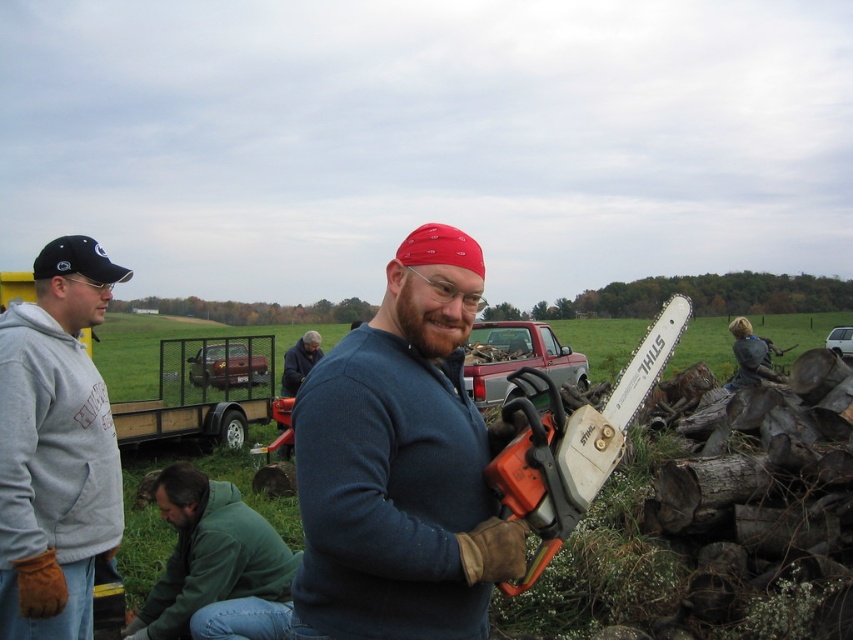
Is white plastic chainsaw at center-right to the left of dark blue sweater at center from the viewer's perspective?

No, white plastic chainsaw at center-right is not to the left of dark blue sweater at center.

Who is more distant from viewer, (543, 376) or (289, 381)?

The point (289, 381) is more distant.

Does point (689, 308) come closer to viewer compared to point (310, 362)?

That is True.

Identify the location of white plastic chainsaw at center-right. This screenshot has height=640, width=853. (573, 442).

Is matte blue sweater at center bigger than green fuzzy jacket at lower left?

Actually, matte blue sweater at center might be smaller than green fuzzy jacket at lower left.

Can you confirm if matte blue sweater at center is positioned to the right of green fuzzy jacket at lower left?

Correct, you'll find matte blue sweater at center to the right of green fuzzy jacket at lower left.

Does point (450, 580) come farther from viewer compared to point (273, 602)?

That is False.

Find the location of a particular element. The image size is (853, 640). matte blue sweater at center is located at coordinates (399, 465).

Who is lower down, matte blue sweater at center or dark blue sweater at center?

dark blue sweater at center is below.

Does matte blue sweater at center appear over dark blue sweater at center?

Yes, matte blue sweater at center is above dark blue sweater at center.

Is point (395, 348) farther from viewer compared to point (305, 365)?

No, (395, 348) is in front of (305, 365).

The image size is (853, 640). I want to click on matte blue sweater at center, so click(399, 465).